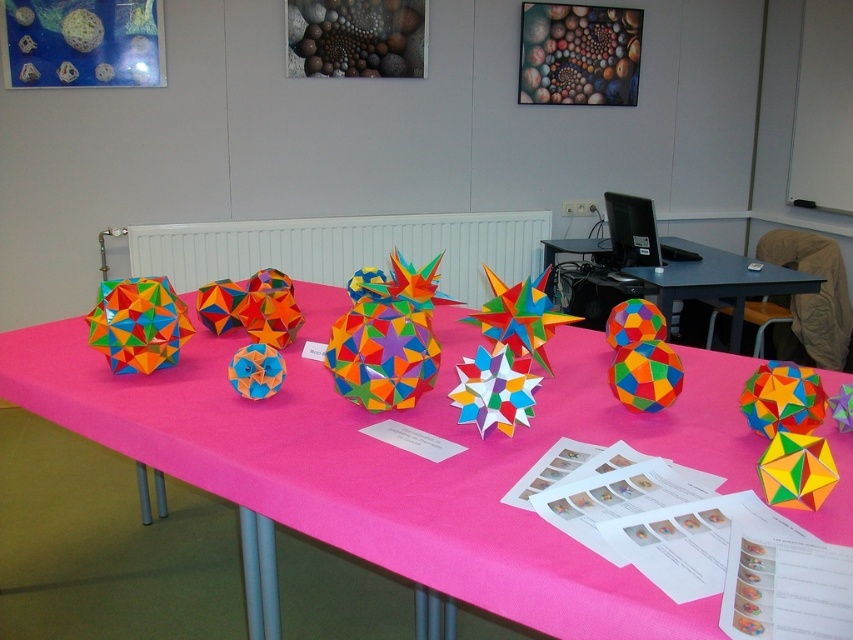
You are standing at the end of the table where the radiator is located. You see two points marked on the table surface. The first is point (62,372) and the second is point (651,282). If you want to reach both points without moving around the table, which point would you encounter first as you walk towards the sculptures?

Point (62,372) is in front of point (651,282), so you would encounter point (62,372) first as you walk towards the sculptures from the radiator end.

You are an artist looking to place a new sculpture on the table. You notice the multicolored paper at center and the multicolored paper star at center. Which one is positioned to the left of the other?

The multicolored paper at center is to the left of the multicolored paper star at center.

You are an artist who needs to place a new sculpture exactly halfway between the multicolored paper at center and the multicolored paper star at center. What is the minimum distance you need to measure from either object to ensure proper placement?

The distance between multicolored paper at center and multicolored paper star at center is 6.10 feet. To place the new sculpture exactly halfway, you should measure 3.05 feet from either object.